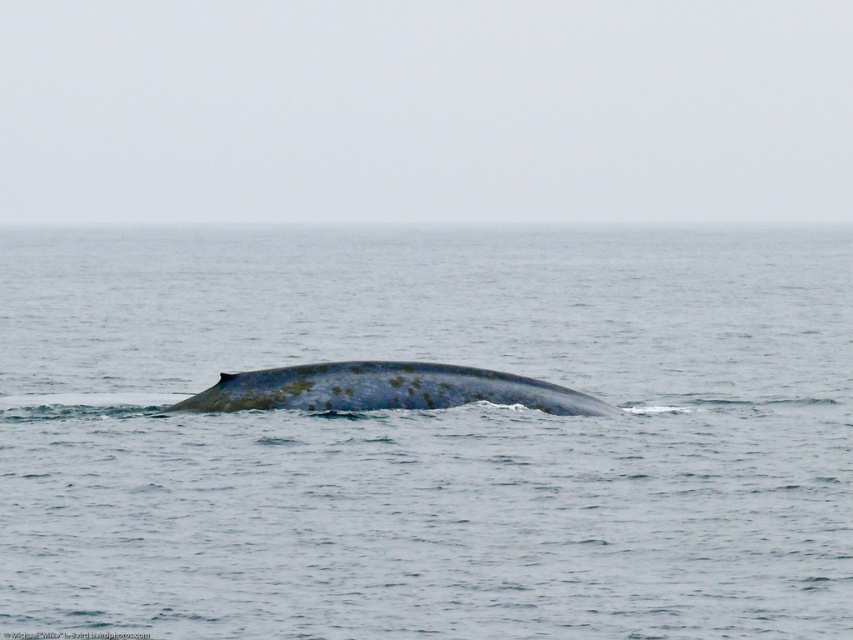
Question: Which object is closer to the camera taking this photo?

Choices:
 (A) blue matte water at center
 (B) blue matte whale at center

Answer: (A)

Question: Does blue matte water at center appear under blue matte whale at center?

Choices:
 (A) yes
 (B) no

Answer: (B)

Question: Can you confirm if blue matte water at center is positioned below blue matte whale at center?

Choices:
 (A) no
 (B) yes

Answer: (A)

Question: Which of the following is the farthest from the observer?

Choices:
 (A) (202, 403)
 (B) (241, 586)

Answer: (A)

Question: Which point appears closest to the camera in this image?

Choices:
 (A) (254, 388)
 (B) (84, 522)

Answer: (B)

Question: Is blue matte water at center above blue matte whale at center?

Choices:
 (A) yes
 (B) no

Answer: (A)